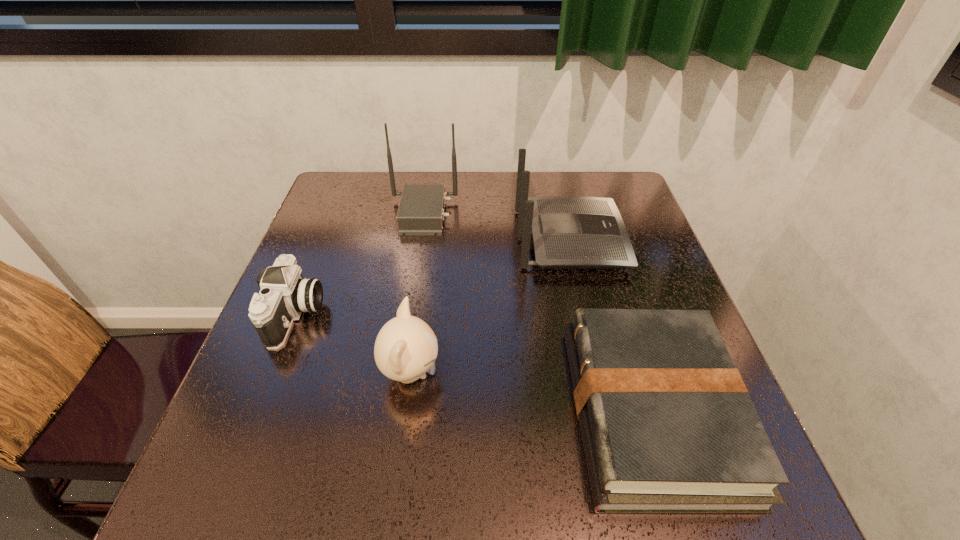
Image resolution: width=960 pixels, height=540 pixels. Find the location of `free region at the right edge of the desktop`. free region at the right edge of the desktop is located at coordinates [628, 231].

The height and width of the screenshot is (540, 960). What are the coordinates of `free location at the far left corner` in the screenshot? It's located at (373, 205).

Find the location of a particular element. This screenshot has height=540, width=960. vacant region at the far right corner of the desktop is located at coordinates (628, 199).

The height and width of the screenshot is (540, 960). Find the location of `free space between the right router and the left router`. free space between the right router and the left router is located at coordinates (496, 227).

Locate an element on the screen. This screenshot has width=960, height=540. vacant point located between the third tallest object and the right router is located at coordinates (491, 306).

Find the location of a particular element. This screenshot has height=540, width=960. free space that is in between the shortest object and the second shortest object is located at coordinates (473, 363).

The height and width of the screenshot is (540, 960). I want to click on free space between the kitten and the right router, so click(491, 306).

Image resolution: width=960 pixels, height=540 pixels. I want to click on empty space between the third tallest object and the fourth tallest object, so click(x=353, y=344).

The width and height of the screenshot is (960, 540). What are the coordinates of `vacant point located between the shortest object and the camera` in the screenshot? It's located at (473, 363).

Image resolution: width=960 pixels, height=540 pixels. What are the coordinates of `free point between the shortest object and the left router` in the screenshot? It's located at (538, 312).